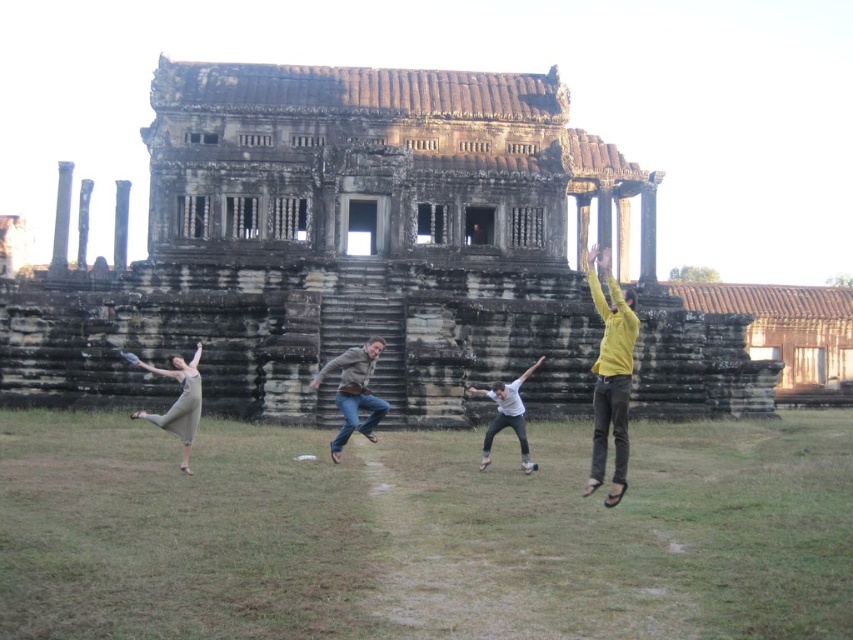
Who is more forward, [430,374] or [605,317]?

Point [605,317] is more forward.

The height and width of the screenshot is (640, 853). Describe the element at coordinates (363, 253) in the screenshot. I see `weathered stone temple at center` at that location.

Find the location of `weathered stone temple at center`. weathered stone temple at center is located at coordinates (x=363, y=253).

Between point (520, 426) and point (129, 352), which one is positioned behind?

The point (129, 352) is more distant.

This screenshot has width=853, height=640. What do you see at coordinates (508, 416) in the screenshot?
I see `white matte shirt at center` at bounding box center [508, 416].

Is point (505, 417) closer to camera compared to point (137, 358)?

Yes, it is in front of point (137, 358).

In order to click on white matte shirt at center in this screenshot , I will do `click(508, 416)`.

Is point (543, 182) behind point (132, 360)?

Yes, point (543, 182) is farther from viewer.

Who is shorter, weathered stone temple at center or white plastic frisbee at center?

white plastic frisbee at center is shorter.

Which is behind, point (572, 378) or point (120, 352)?

Positioned behind is point (572, 378).

At what (x,y) coordinates should I click in order to perform the action: click on weathered stone temple at center. Please return your answer as a coordinate pair (x, y). This screenshot has height=640, width=853. Looking at the image, I should click on (363, 253).